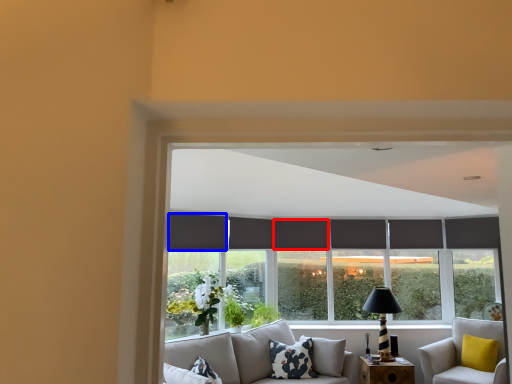
Question: Which object is further to the camera taking this photo, curtain (highlighted by a red box) or curtain (highlighted by a blue box)?

Choices:
 (A) curtain
 (B) curtain

Answer: (A)